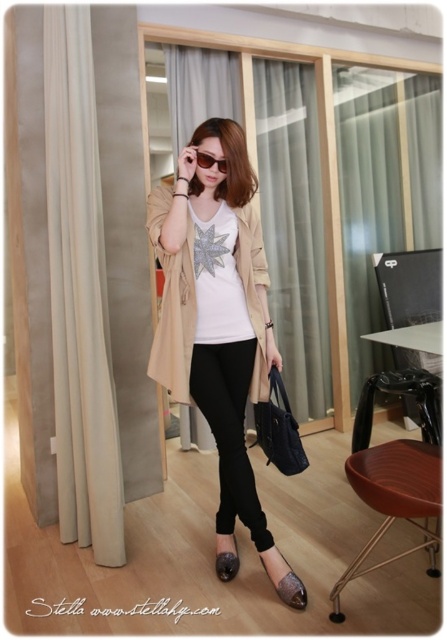
You are a photographer setting up a shoot in this scene. You need to place a rectangular backdrop that is 1.2 meters wide. The backdrop must be positioned between the brown wood stool at lower right and the sunglasses at center. Can the space between them accommodate the backdrop?

The brown wood stool at lower right is wider than the sunglasses at center. However, the exact distance between them isn

You are a photographer setting up a shoot in this scene. You need to place a small prop exactly at the point marked by the coordinates provided. The prop is a silver star that must be placed so it doesn not cover any part of the person or their clothing. Is the point at coordinates point (227,563) safe for placing the silver star?

The point (227,563) marks the matte black sandal at lower center. Placing the silver star here would cover part of the person s clothing, specifically the sandal, so it is not safe.